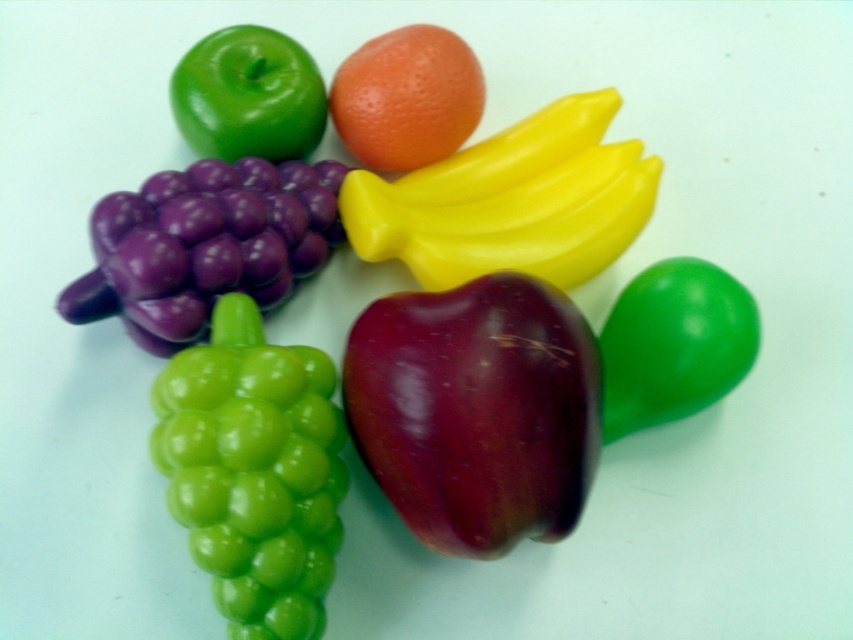
You are arranging a fruit platter and need to place the purple glossy grapes at left and the green matte pepper at lower right. Based on their positions, which one is closer to you?

The purple glossy grapes at left is closer to you because it is in front of the green matte pepper at lower right.

You are standing in front of the artificial fruit arrangement and want to touch the two points mentioned. Which point, point (520,452) or point (534,156), is closer to you?

Point (520,452) is closer to you than point (534,156).

You are arranging fruits on a table and need to place a new fruit between the shiny dark red apple at center and the purple glossy grapes at left. Based on their positions, which side should you place the new fruit relative to the grapes?

You should place the new fruit to the right of the purple glossy grapes at left since the shiny dark red apple at center is already positioned to the right of them.